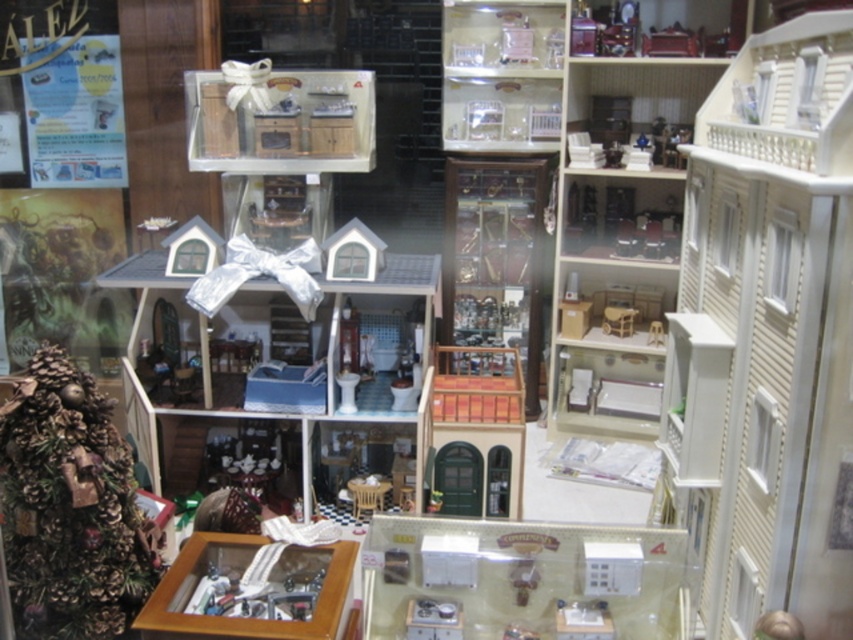
You are standing in front of the miniature display and want to locate the green pinecone tree at left. Can you tell me its exact 2D coordinates in the image?

The green pinecone tree at left is located at the 2D coordinates point [70,508].

You are a customer in a dollhouse store and want to place a new miniature accessory between the green pinecone tree at left and the metallic silver scale at center. Which object should you place the accessory closer to if you want it to appear larger in the display?

Place the accessory closer to the green pinecone tree at left because objects closer to the viewer appear larger in the display.